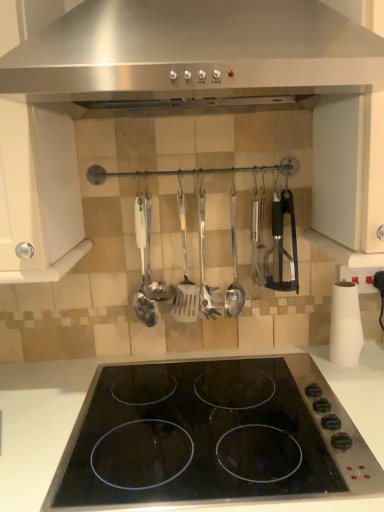
Question: Can you confirm if satin silver spatula at center, the 3th spatula from the right, is positioned to the right of satin silver spatula at center, which is the 2th spatula from left to right?

Choices:
 (A) no
 (B) yes

Answer: (A)

Question: Is satin silver spatula at center, which is counted as the 1th spatula, starting from the left, directly adjacent to satin silver spatula at center, which is the second spatula from right to left?

Choices:
 (A) no
 (B) yes

Answer: (B)

Question: Would you say satin silver spatula at center, which is the 2th spatula from left to right, is part of satin silver spatula at center, the 3th spatula from the right,'s contents?

Choices:
 (A) yes
 (B) no

Answer: (B)

Question: Is the position of satin silver spatula at center, the 3th spatula from the right, less distant than that of satin silver spatula at center, which is the 2th spatula from left to right?

Choices:
 (A) no
 (B) yes

Answer: (B)

Question: From the image's perspective, is satin silver spatula at center, which is the second spatula from right to left, above or below black glass electric stove at center?

Choices:
 (A) below
 (B) above

Answer: (B)

Question: Is satin silver spatula at center, which is the 2th spatula from left to right, taller or shorter than black glass electric stove at center?

Choices:
 (A) tall
 (B) short

Answer: (B)

Question: In terms of size, does satin silver spatula at center, which is the 2th spatula from left to right, appear bigger or smaller than black glass electric stove at center?

Choices:
 (A) big
 (B) small

Answer: (B)

Question: Is point (182, 212) closer or farther from the camera than point (200, 445)?

Choices:
 (A) closer
 (B) farther

Answer: (B)

Question: From a real-world perspective, is satin silver spoon at center physically located above or below black glass electric stove at center?

Choices:
 (A) below
 (B) above

Answer: (B)

Question: From the image's perspective, relative to black glass electric stove at center, is satin silver spoon at center above or below?

Choices:
 (A) above
 (B) below

Answer: (A)

Question: Based on their sizes in the image, would you say satin silver spoon at center is bigger or smaller than black glass electric stove at center?

Choices:
 (A) small
 (B) big

Answer: (A)

Question: Relative to black glass electric stove at center, is satin silver spoon at center in front or behind?

Choices:
 (A) front
 (B) behind

Answer: (B)

Question: Looking at their shapes, would you say black glass electric stove at center is wider or thinner than satin silver spatula at center, which is the 2th spatula from left to right?

Choices:
 (A) thin
 (B) wide

Answer: (B)

Question: In the image, is black glass electric stove at center positioned in front of or behind satin silver spatula at center, which is the second spatula from right to left?

Choices:
 (A) front
 (B) behind

Answer: (A)